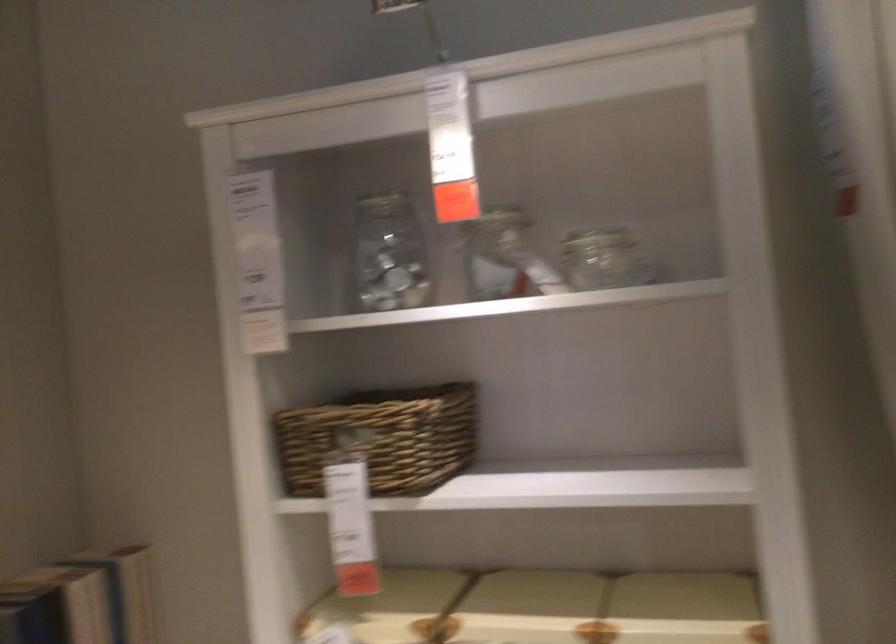
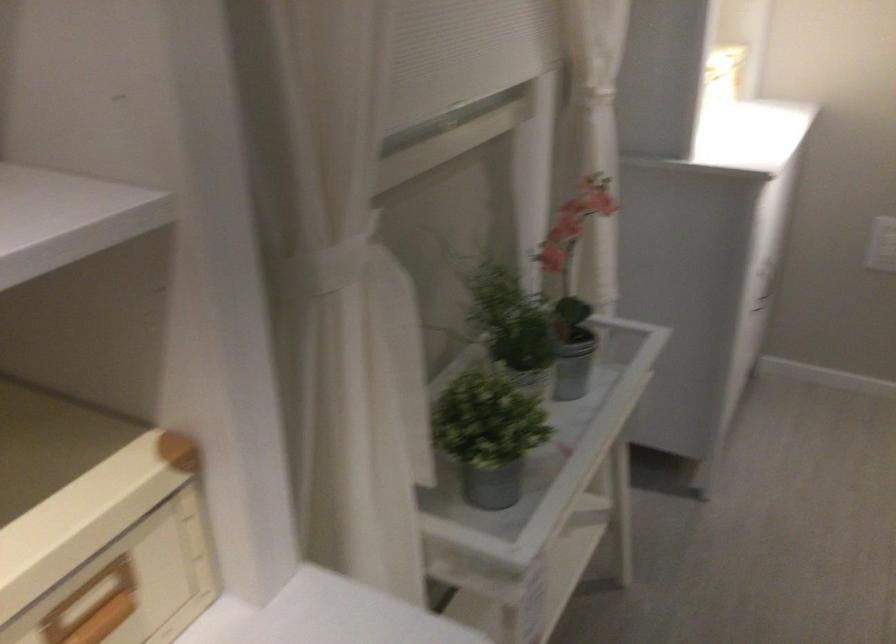
How did the camera likely rotate?

The rotation direction of the camera is right-down.